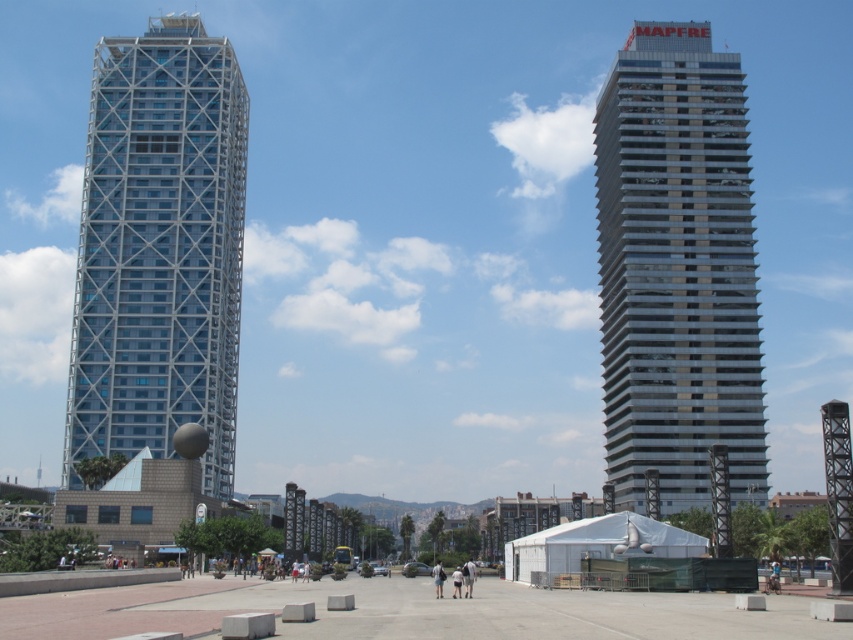
You are a city planner assessing the potential for a new public park between the glassy silver skyscraper at right and the translucent glass skyscraper at left. Given that the minimum required space for the park is 50 meters, can the available space accommodate it?

The distance between the glassy silver skyscraper at right and the translucent glass skyscraper at left is 50.90 meters, which exceeds the minimum requirement of 50 meters. Therefore, the space can accommodate the new public park.

You are an architect planning to install a large billboard between the glassy silver skyscraper at right and the translucent glass skyscraper at left. The billboard must be placed in such a way that it is visible from both buildings. Given their sizes, which skyscraper should the billboard be closer to to ensure visibility?

The billboard should be placed closer to the translucent glass skyscraper at left because the glassy silver skyscraper at right is bigger, so positioning it closer to the smaller one ensures balanced visibility from both buildings.

You are a city planner reviewing the urban layout. You notice the glassy silver skyscraper at right and the translucent glass skyscraper at left. Which of these two buildings is located closer to the ground level based on their positions in the image?

The glassy silver skyscraper at right is positioned under the translucent glass skyscraper at left, meaning it is closer to the ground level.